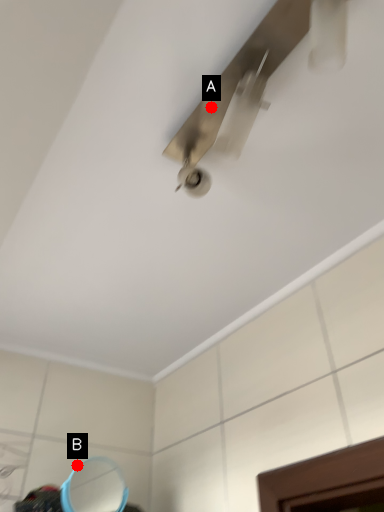
Question: Two points are circled on the image, labeled by A and B beside each circle. Which point is farther to the camera?

Choices:
 (A) A is further
 (B) B is further

Answer: (B)